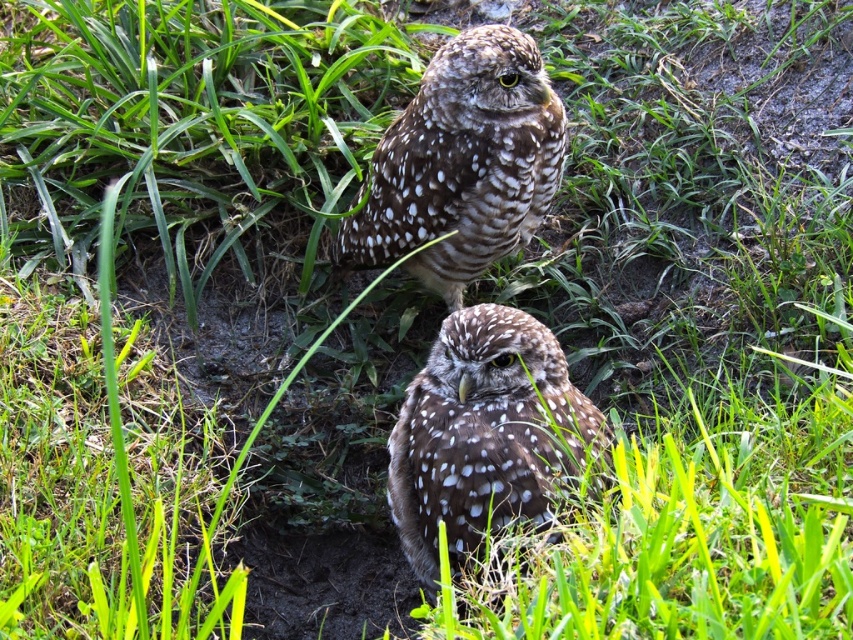
Question: Which of the following is the closest to the observer?

Choices:
 (A) speckled brown owl at upper center
 (B) speckled brown owl at center

Answer: (B)

Question: Is speckled brown owl at upper center positioned behind speckled brown owl at center?

Choices:
 (A) no
 (B) yes

Answer: (B)

Question: In this image, where is speckled brown owl at upper center located relative to speckled brown owl at center?

Choices:
 (A) left
 (B) right

Answer: (A)

Question: Can you confirm if speckled brown owl at upper center is positioned to the left of speckled brown owl at center?

Choices:
 (A) no
 (B) yes

Answer: (B)